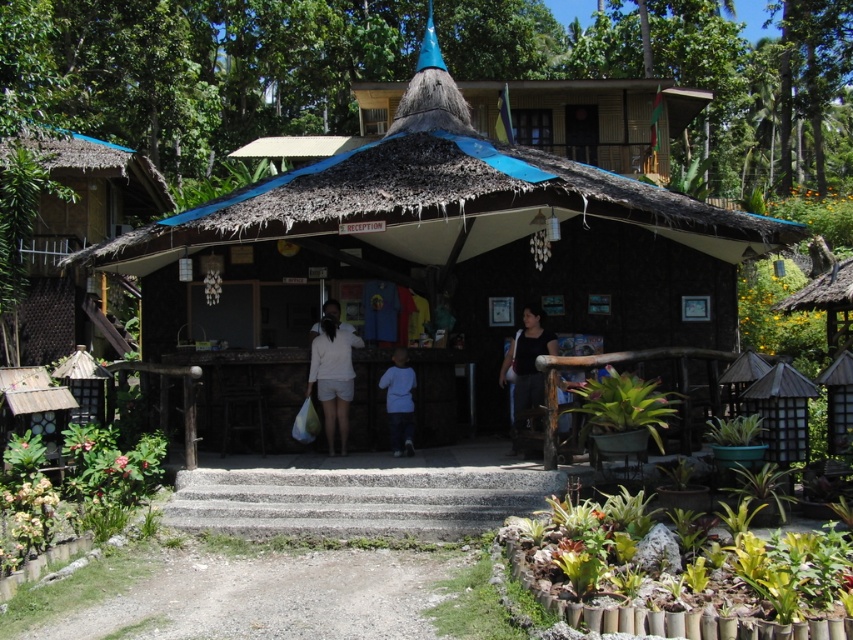
Looking at this image, does gray concrete stairs at center come in front of black fabric shirt at center?

Yes, it is.

Can you confirm if gray concrete stairs at center is taller than black fabric shirt at center?

No, gray concrete stairs at center is not taller than black fabric shirt at center.

Describe the element at coordinates (357, 500) in the screenshot. I see `gray concrete stairs at center` at that location.

The height and width of the screenshot is (640, 853). In order to click on gray concrete stairs at center in this screenshot , I will do `click(357, 500)`.

Does gray concrete stairs at center appear on the right side of light blue fabric at center?

No, gray concrete stairs at center is not to the right of light blue fabric at center.

Who is shorter, gray concrete stairs at center or light blue fabric at center?

→ gray concrete stairs at center

Locate an element on the screen. This screenshot has height=640, width=853. gray concrete stairs at center is located at coordinates (357, 500).

Can you confirm if black fabric shirt at center is positioned to the left of light blue fabric at center?

Incorrect, black fabric shirt at center is not on the left side of light blue fabric at center.

The image size is (853, 640). I want to click on black fabric shirt at center, so click(x=527, y=364).